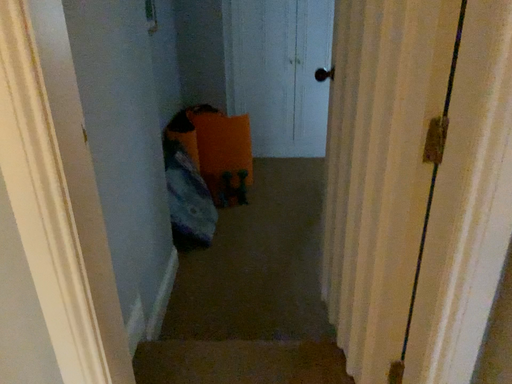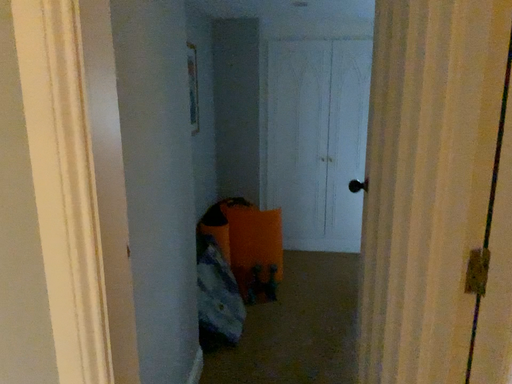
Question: How did the camera likely rotate when shooting the video?

Choices:
 (A) rotated upward
 (B) rotated downward

Answer: (A)